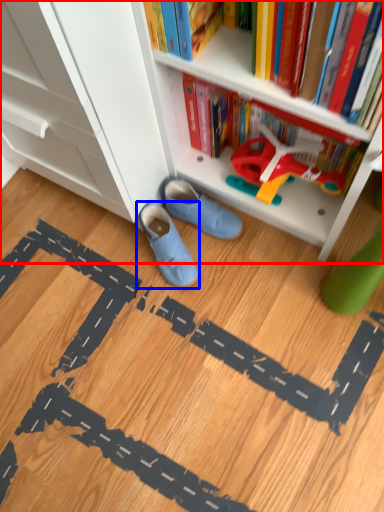
Question: Which point is closer to the camera, bookcase (highlighted by a red box) or footwear (highlighted by a blue box)?

Choices:
 (A) bookcase
 (B) footwear

Answer: (A)